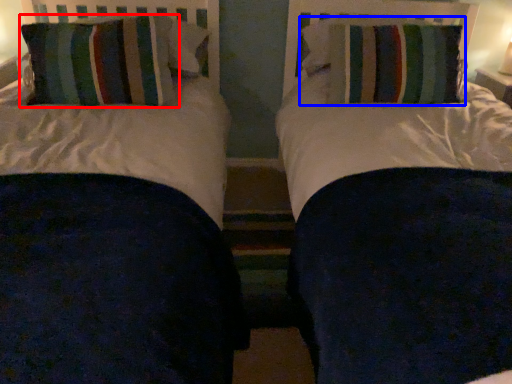
Question: Which point is closer to the camera, pillow (highlighted by a red box) or pillow (highlighted by a blue box)?

Choices:
 (A) pillow
 (B) pillow

Answer: (A)